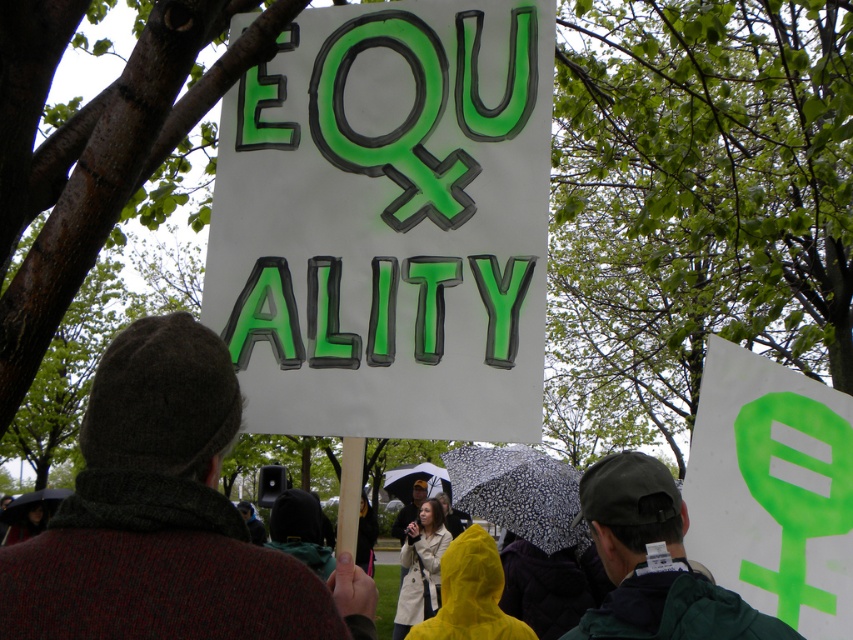
You are a photographer trying to capture a clear shot of the knitted wool hat at center and the transparent plastic umbrella at lower left. Since the scene is crowded, you need to adjust your camera angle. Which object should you focus on first to ensure both are in frame?

The knitted wool hat at center is above the transparent plastic umbrella at lower left, so you should focus on the transparent plastic umbrella at lower left first to ensure both are in frame.